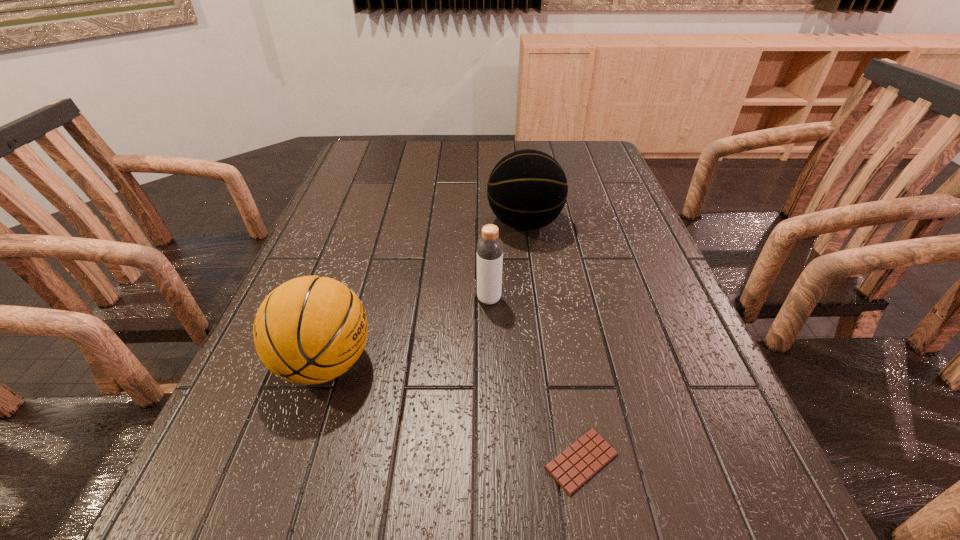
Image resolution: width=960 pixels, height=540 pixels. Identify the location of vacant space located 0.100m on the back of the shortest object. (566, 379).

Identify the location of object situated at the left edge. pos(309,330).

In the image, there is a desktop. Where is `free space at the far edge`? The width and height of the screenshot is (960, 540). free space at the far edge is located at coordinates (481, 155).

Where is `free space at the right edge of the desktop`? free space at the right edge of the desktop is located at coordinates (592, 253).

I want to click on free space at the far left corner of the desktop, so click(x=362, y=153).

The height and width of the screenshot is (540, 960). Identify the location of free spot between the bottle and the farthest object. (507, 261).

The height and width of the screenshot is (540, 960). I want to click on free spot between the second nearest object and the third nearest object, so click(x=407, y=331).

In order to click on vacant area that lies between the bottle and the farthest object in this screenshot , I will do click(x=507, y=261).

The width and height of the screenshot is (960, 540). In order to click on vacant area that lies between the bottle and the nearer basketball in this screenshot , I will do `click(407, 331)`.

Where is `vacant space that is in between the bottle and the nearest object`? vacant space that is in between the bottle and the nearest object is located at coordinates (535, 380).